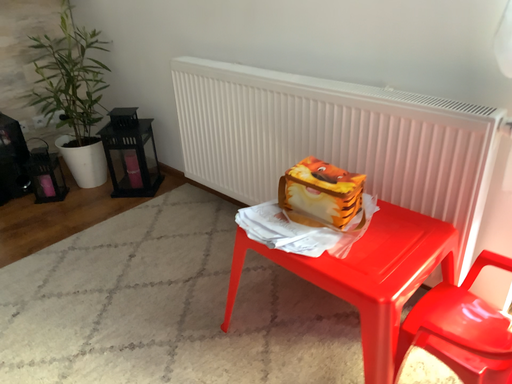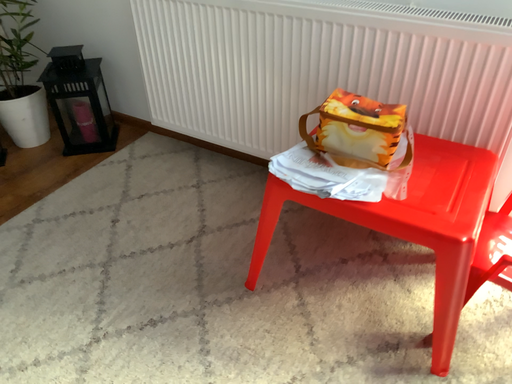
Question: Which way did the camera rotate in the video?

Choices:
 (A) rotated right
 (B) rotated left

Answer: (A)